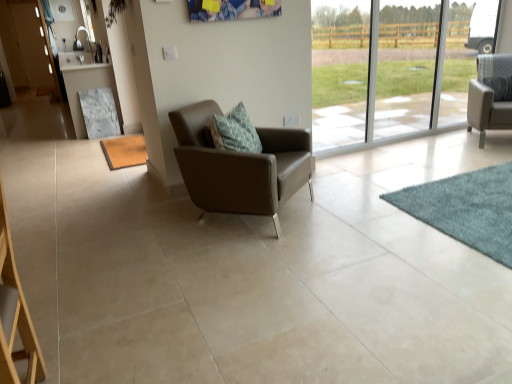
Where is `vacant region in front of transparent glass window at right`? Image resolution: width=512 pixels, height=384 pixels. vacant region in front of transparent glass window at right is located at coordinates (442, 158).